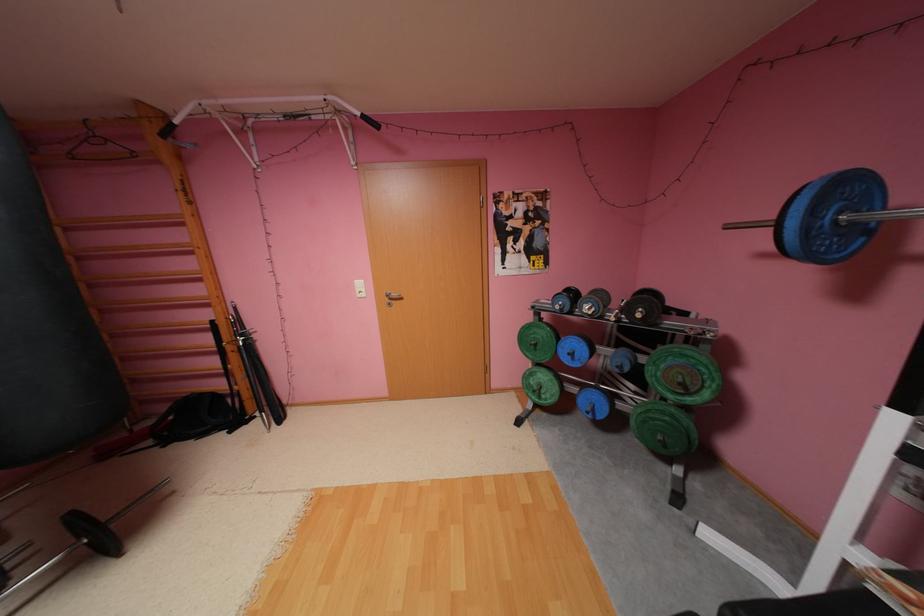
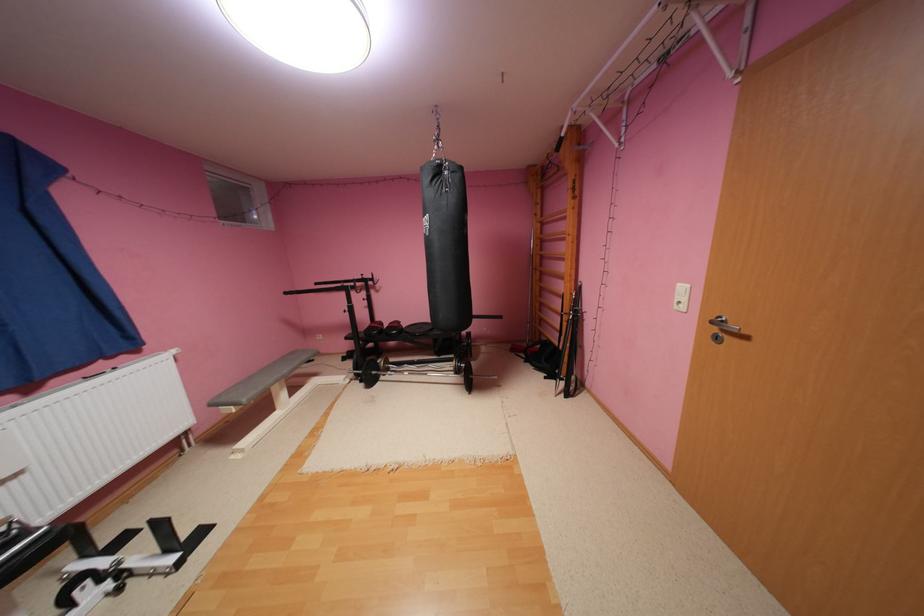
Where in the second image is the point corresponding to point (185, 122) from the first image?

(572, 135)